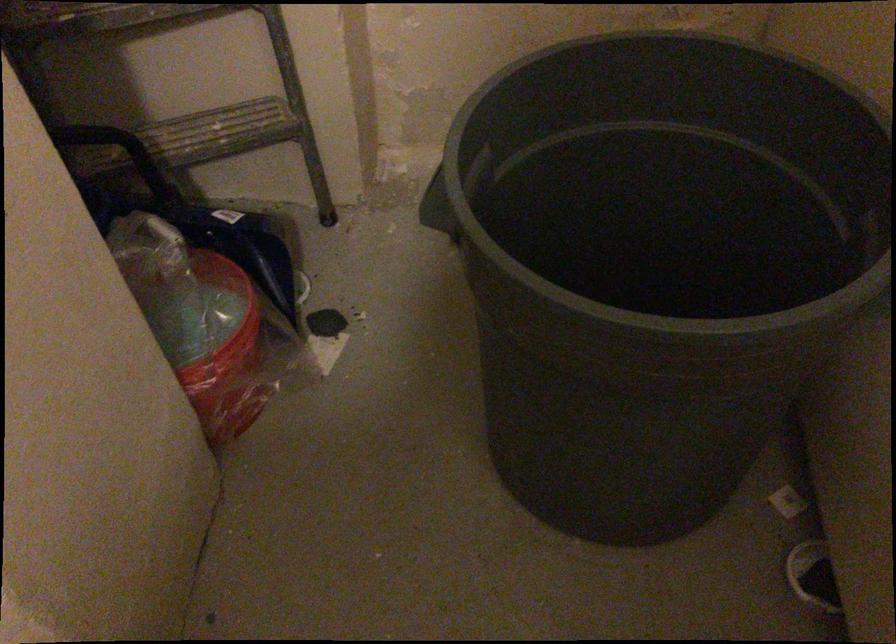
You are a GUI agent. You are given a task and a screenshot of the screen. Output one action in this format:
    pyautogui.click(x=<x>, y=<y>)
    Task: Click on the ladder step
    This screenshot has width=896, height=644.
    Given the screenshot: What is the action you would take?
    pyautogui.click(x=213, y=128)